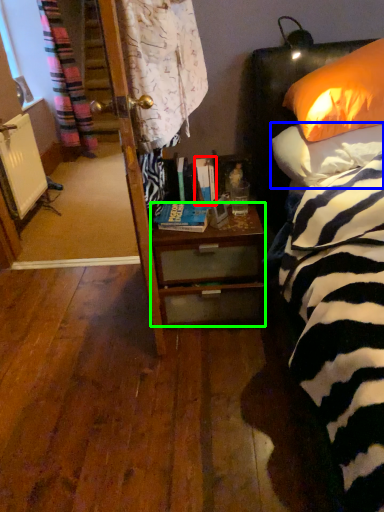
Question: Estimate the real-world distances between objects in this image. Which object is farther from book (highlighted by a red box), pillow (highlighted by a blue box) or desk (highlighted by a green box)?

Choices:
 (A) pillow
 (B) desk

Answer: (A)